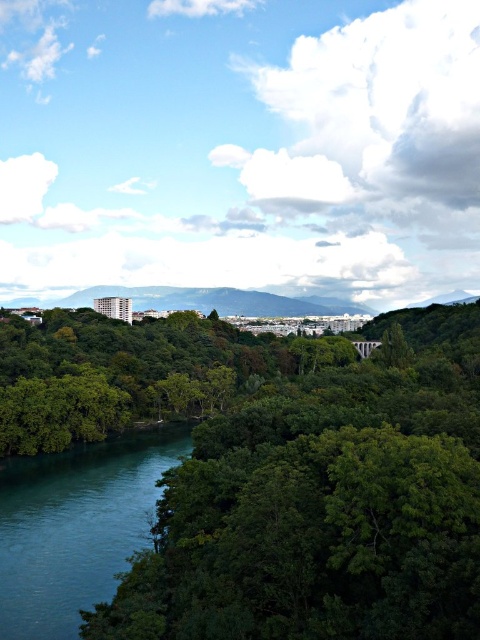
Which is more to the left, green leafy tree at center or teal smooth water at lower left?

From the viewer's perspective, teal smooth water at lower left appears more on the left side.

Does green leafy tree at center have a lesser width compared to teal smooth water at lower left?

In fact, green leafy tree at center might be wider than teal smooth water at lower left.

Does point (384, 419) lie in front of point (112, 474)?

Yes, point (384, 419) is in front of point (112, 474).

Identify the location of green leafy tree at center. (324, 502).